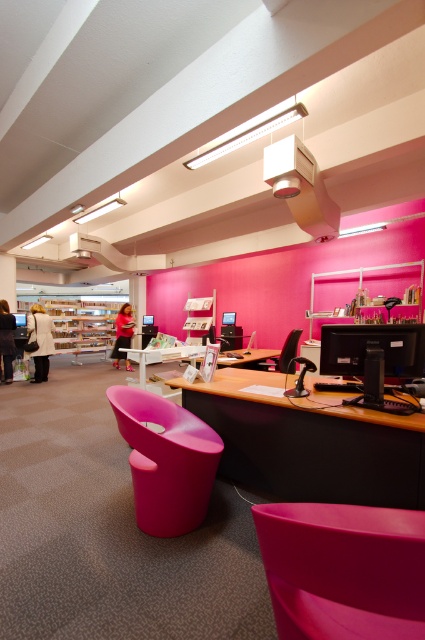
Is point (323, 326) more distant than point (289, 368)?

That is False.

Between black glossy monitor at center and pink plastic chair at center, which one has less height?

Standing shorter between the two is black glossy monitor at center.

This screenshot has height=640, width=425. Describe the element at coordinates (373, 360) in the screenshot. I see `black glossy monitor at center` at that location.

This screenshot has width=425, height=640. Identify the location of black glossy monitor at center. (373, 360).

Is point (167, 406) behind point (121, 310)?

No, it is in front of (121, 310).

Is matte plastic swivel chair at lower left further to camera compared to pink fabric person at center?

No, it is in front of pink fabric person at center.

Who is more forward, (198,502) or (125,339)?

Point (198,502) is in front.

Identify the location of matte plastic swivel chair at lower left. (166, 460).

Does white matte coat at center appear on the left side of pink fabric person at center?

Yes, white matte coat at center is to the left of pink fabric person at center.

Does white matte coat at center appear under pink fabric person at center?

No.

Where is `white matte coat at center`? This screenshot has width=425, height=640. white matte coat at center is located at coordinates (39, 340).